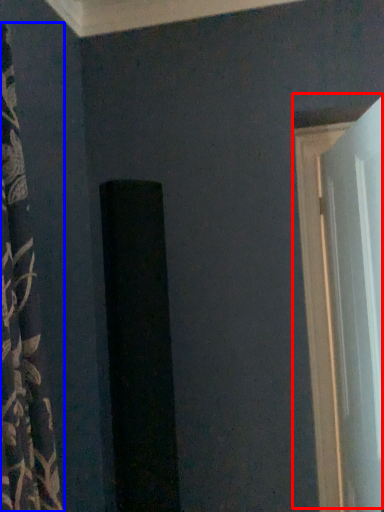
Question: Which object appears closest to the camera in this image, door (highlighted by a red box) or curtain (highlighted by a blue box)?

Choices:
 (A) door
 (B) curtain

Answer: (B)